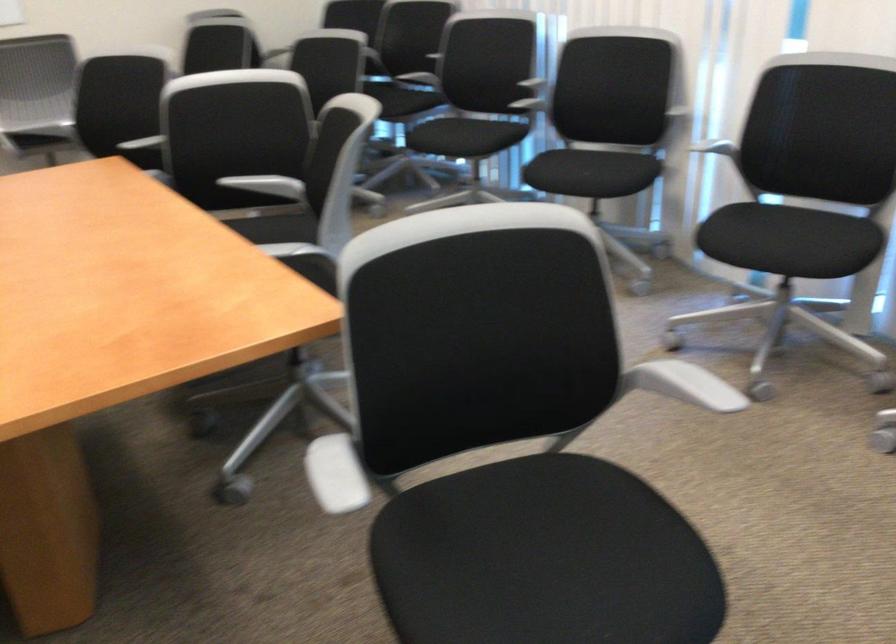
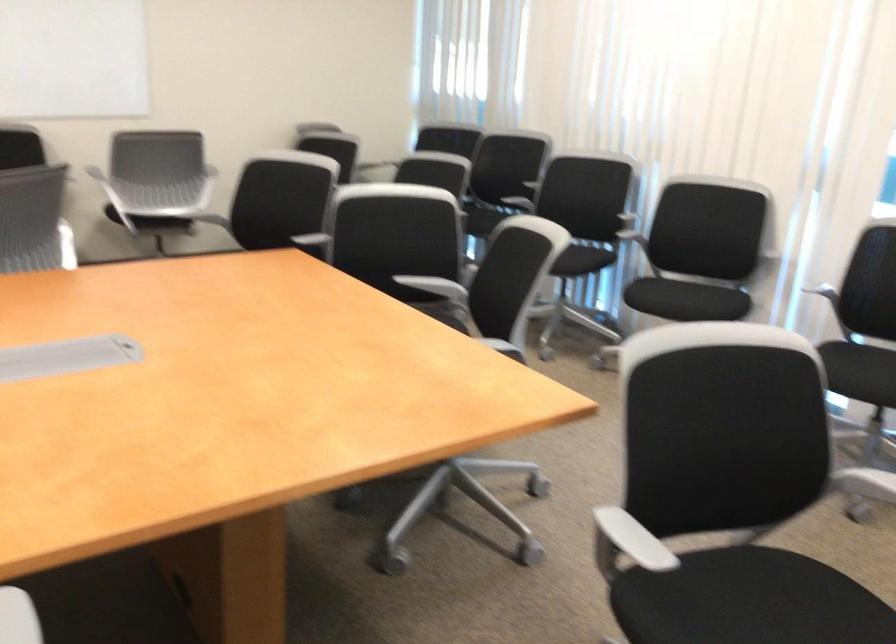
Question: Based on the continuous images, in which direction is the camera rotating? Reply with the corresponding letter.

Choices:
 (A) Left
 (B) Right
 (C) Up
 (D) Down

Answer: (C)